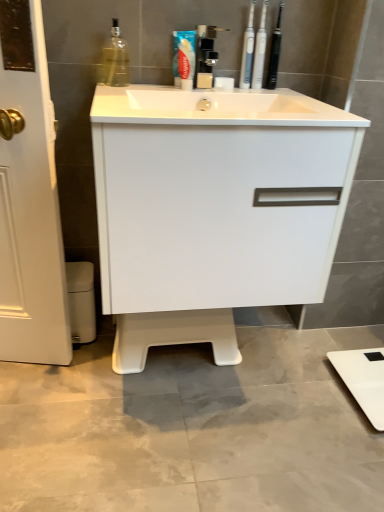
Question: Considering the relative sizes of black plastic toothbrushes at upper center, which is the 3th toiletry from left to right, and white glossy cabinet at center in the image provided, is black plastic toothbrushes at upper center, which is the 3th toiletry from left to right, bigger than white glossy cabinet at center?

Choices:
 (A) no
 (B) yes

Answer: (A)

Question: From the image's perspective, is black plastic toothbrushes at upper center, which is the 3th toiletry from left to right, located beneath white glossy cabinet at center?

Choices:
 (A) yes
 (B) no

Answer: (B)

Question: Can you confirm if black plastic toothbrushes at upper center, which is the 3th toiletry from left to right, is taller than white glossy cabinet at center?

Choices:
 (A) no
 (B) yes

Answer: (A)

Question: Is white glossy cabinet at center at the back of black plastic toothbrushes at upper center, which is the 3th toiletry from left to right?

Choices:
 (A) no
 (B) yes

Answer: (A)

Question: Is black plastic toothbrushes at upper center, the first toiletry when ordered from right to left, shorter than white glossy cabinet at center?

Choices:
 (A) yes
 (B) no

Answer: (A)

Question: Relative to white plastic toothbrushes at upper center, which is the second toiletry in left-to-right order, is black plastic toothbrushes at upper center, which is the 3th toiletry from left to right, in front or behind?

Choices:
 (A) behind
 (B) front

Answer: (A)

Question: From their relative heights in the image, would you say black plastic toothbrushes at upper center, which is the 3th toiletry from left to right, is taller or shorter than white plastic toothbrushes at upper center, which is the second toiletry in left-to-right order?

Choices:
 (A) short
 (B) tall

Answer: (A)

Question: From a real-world perspective, is black plastic toothbrushes at upper center, the first toiletry when ordered from right to left, physically located above or below white plastic toothbrushes at upper center, the 2th toiletry in the right-to-left sequence?

Choices:
 (A) below
 (B) above

Answer: (B)

Question: Is point (269, 78) closer or farther from the camera than point (256, 47)?

Choices:
 (A) closer
 (B) farther

Answer: (B)

Question: Would you say blue glossy toothpaste at upper center is to the left or to the right of black plastic toothbrushes at upper center, the first toiletry when ordered from right to left, in the picture?

Choices:
 (A) right
 (B) left

Answer: (B)

Question: From the image's perspective, is blue glossy toothpaste at upper center positioned above or below black plastic toothbrushes at upper center, the first toiletry when ordered from right to left?

Choices:
 (A) below
 (B) above

Answer: (A)

Question: Looking at the image, does blue glossy toothpaste at upper center seem bigger or smaller compared to black plastic toothbrushes at upper center, the first toiletry when ordered from right to left?

Choices:
 (A) small
 (B) big

Answer: (B)

Question: From their relative heights in the image, would you say blue glossy toothpaste at upper center is taller or shorter than black plastic toothbrushes at upper center, which is the 3th toiletry from left to right?

Choices:
 (A) short
 (B) tall

Answer: (A)

Question: Looking at their shapes, would you say black plastic toothbrushes at upper center, which is the 3th toiletry from left to right, is wider or thinner than satin nickel faucet at upper center?

Choices:
 (A) wide
 (B) thin

Answer: (B)

Question: From a real-world perspective, is black plastic toothbrushes at upper center, which is the 3th toiletry from left to right, positioned above or below satin nickel faucet at upper center?

Choices:
 (A) above
 (B) below

Answer: (A)